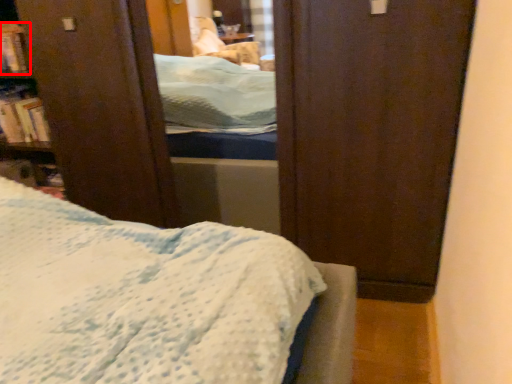
Question: From the image, what is the correct spatial relationship of book (annotated by the red box) in relation to book?

Choices:
 (A) right
 (B) left

Answer: (B)